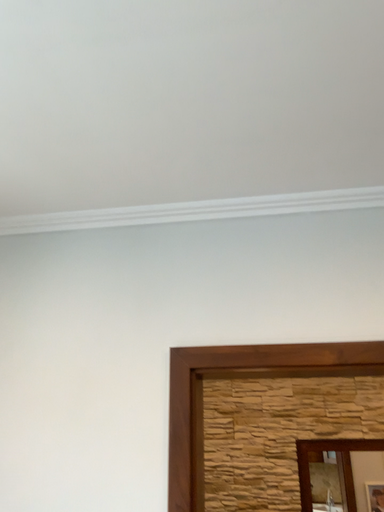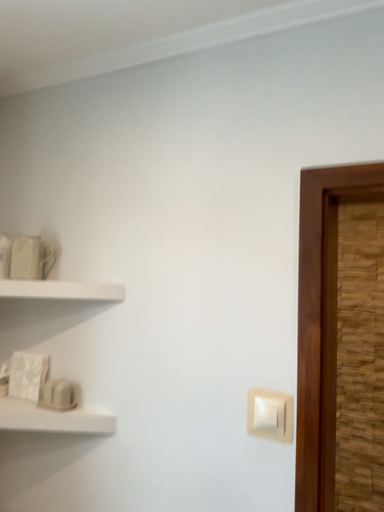
Question: How did the camera likely rotate when shooting the video?

Choices:
 (A) rotated upward
 (B) rotated downward

Answer: (B)